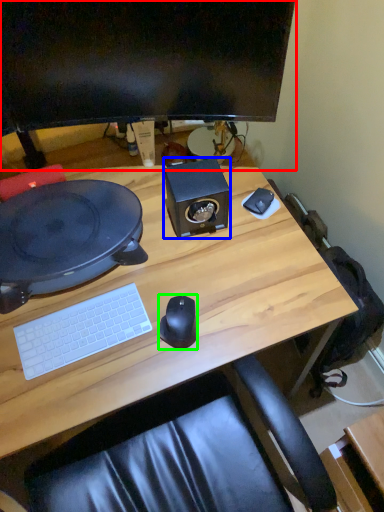
Question: Estimate the real-world distances between objects in this image. Which object is closer to computer monitor (highlighted by a red box), speaker (highlighted by a blue box) or mouse (highlighted by a green box)?

Choices:
 (A) speaker
 (B) mouse

Answer: (A)